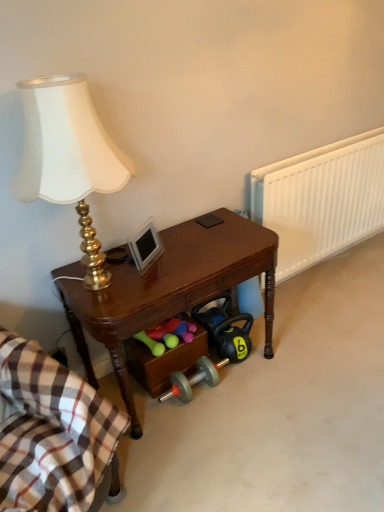
Question: Would you say plaid cotton blanket at lower left is inside or outside shiny brown desk at center?

Choices:
 (A) inside
 (B) outside

Answer: (B)

Question: From the image's perspective, is plaid cotton blanket at lower left positioned above or below shiny brown desk at center?

Choices:
 (A) below
 (B) above

Answer: (A)

Question: Estimate the real-world distances between objects in this image. Which object is farther from the wooden drawer at lower center?

Choices:
 (A) plaid cotton blanket at lower left
 (B) rubberized green dumbbells at lower center
 (C) gold metallic lamp at left
 (D) shiny brown desk at center
 (E) white plastic radiator at right

Answer: (E)

Question: Based on their relative distances, which object is nearer to the wooden drawer at lower center?

Choices:
 (A) plaid cotton blanket at lower left
 (B) gold metallic lamp at left
 (C) rubberized green dumbbells at lower center
 (D) white plastic radiator at right
 (E) shiny brown desk at center

Answer: (C)